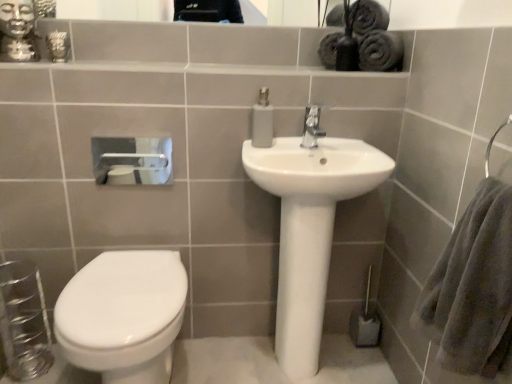
Question: Is gold metallic statue at upper left at the right side of glossy ceramic mirror at upper center?

Choices:
 (A) no
 (B) yes

Answer: (A)

Question: Can glossy ceramic mirror at upper center be found inside gold metallic statue at upper left?

Choices:
 (A) no
 (B) yes

Answer: (A)

Question: From a real-world perspective, is gold metallic statue at upper left on glossy ceramic mirror at upper center?

Choices:
 (A) yes
 (B) no

Answer: (B)

Question: Is gold metallic statue at upper left not close to glossy ceramic mirror at upper center?

Choices:
 (A) yes
 (B) no

Answer: (A)

Question: Does gold metallic statue at upper left have a lesser height compared to glossy ceramic mirror at upper center?

Choices:
 (A) yes
 (B) no

Answer: (B)

Question: Considering the relative sizes of gold metallic statue at upper left and glossy ceramic mirror at upper center in the image provided, is gold metallic statue at upper left bigger than glossy ceramic mirror at upper center?

Choices:
 (A) yes
 (B) no

Answer: (A)

Question: Is the surface of glossy ceramic mirror at upper center in direct contact with white matte toilet paper at upper left?

Choices:
 (A) yes
 (B) no

Answer: (B)

Question: From the image's perspective, does glossy ceramic mirror at upper center appear lower than white matte toilet paper at upper left?

Choices:
 (A) yes
 (B) no

Answer: (B)

Question: Considering the relative sizes of glossy ceramic mirror at upper center and white matte toilet paper at upper left in the image provided, is glossy ceramic mirror at upper center smaller than white matte toilet paper at upper left?

Choices:
 (A) no
 (B) yes

Answer: (A)

Question: Considering the relative sizes of glossy ceramic mirror at upper center and white matte toilet paper at upper left in the image provided, is glossy ceramic mirror at upper center shorter than white matte toilet paper at upper left?

Choices:
 (A) yes
 (B) no

Answer: (A)

Question: Is glossy ceramic mirror at upper center not inside white matte toilet paper at upper left?

Choices:
 (A) no
 (B) yes

Answer: (B)

Question: Does glossy ceramic mirror at upper center turn towards white matte toilet paper at upper left?

Choices:
 (A) no
 (B) yes

Answer: (A)

Question: From the image's perspective, is white glossy toilet at lower left below gray fluffy bath towel at right?

Choices:
 (A) yes
 (B) no

Answer: (A)